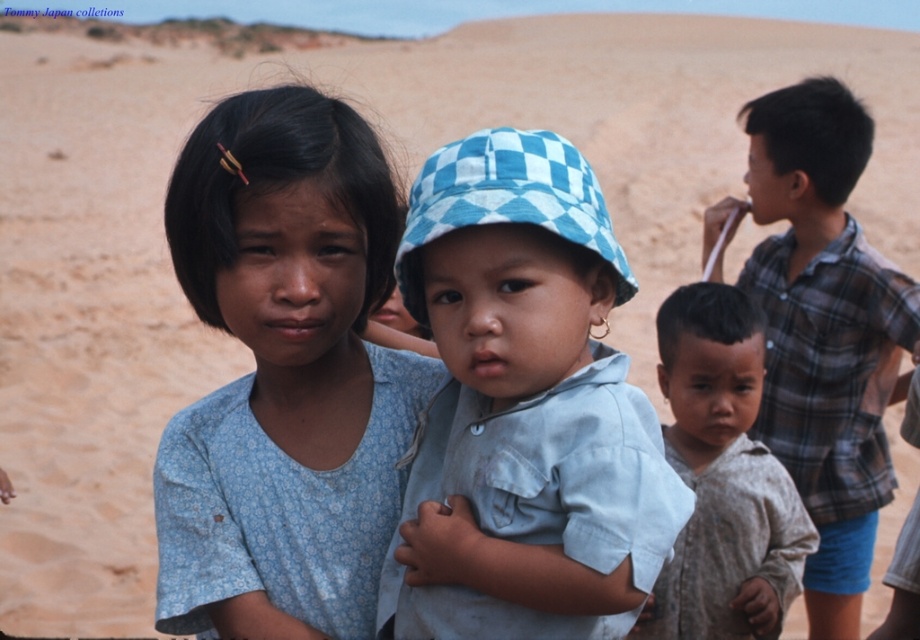
Between plaid cotton shirt at right and brown cotton shirt at lower right, which one is positioned lower?

brown cotton shirt at lower right

What do you see at coordinates (823, 330) in the screenshot?
I see `plaid cotton shirt at right` at bounding box center [823, 330].

Find the location of a particular element. This screenshot has width=920, height=640. plaid cotton shirt at right is located at coordinates (823, 330).

Can you confirm if blue floral shirt at center is positioned to the right of plaid cotton shirt at right?

In fact, blue floral shirt at center is to the left of plaid cotton shirt at right.

Who is lower down, blue floral shirt at center or plaid cotton shirt at right?

blue floral shirt at center is lower down.

Locate an element on the screen. Image resolution: width=920 pixels, height=640 pixels. blue floral shirt at center is located at coordinates (284, 374).

Between light blue checkered hat at center and plaid cotton shirt at right, which one has more height?

Standing taller between the two is plaid cotton shirt at right.

What do you see at coordinates (523, 406) in the screenshot? I see `light blue checkered hat at center` at bounding box center [523, 406].

This screenshot has width=920, height=640. Find the location of `light blue checkered hat at center`. light blue checkered hat at center is located at coordinates (523, 406).